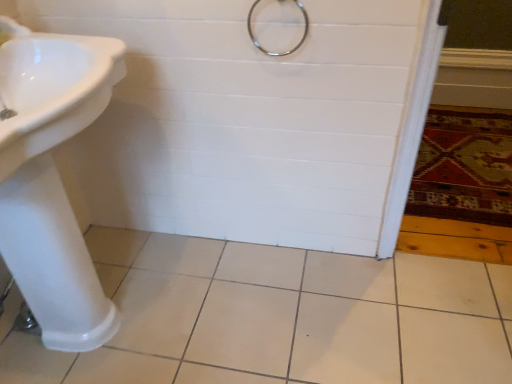
Question: Considering the positions of white ceramic tile at center and metallic ring at upper center in the image, is white ceramic tile at center taller or shorter than metallic ring at upper center?

Choices:
 (A) tall
 (B) short

Answer: (B)

Question: Is white ceramic tile at center inside the boundaries of metallic ring at upper center, or outside?

Choices:
 (A) outside
 (B) inside

Answer: (A)

Question: Considering the real-world distances, which object is farthest from the white ceramic tile at center?

Choices:
 (A) metallic ring at upper center
 (B) white glossy sink at left
 (C) carpeted rug at lower right

Answer: (A)

Question: Estimate the real-world distances between objects in this image. Which object is farther from the white ceramic tile at center?

Choices:
 (A) carpeted rug at lower right
 (B) metallic ring at upper center
 (C) white glossy sink at left

Answer: (B)